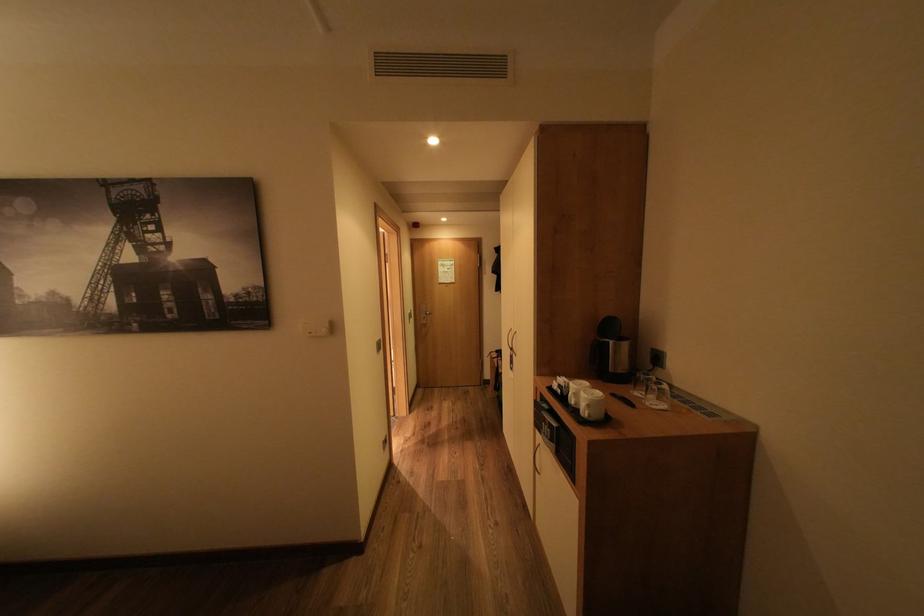
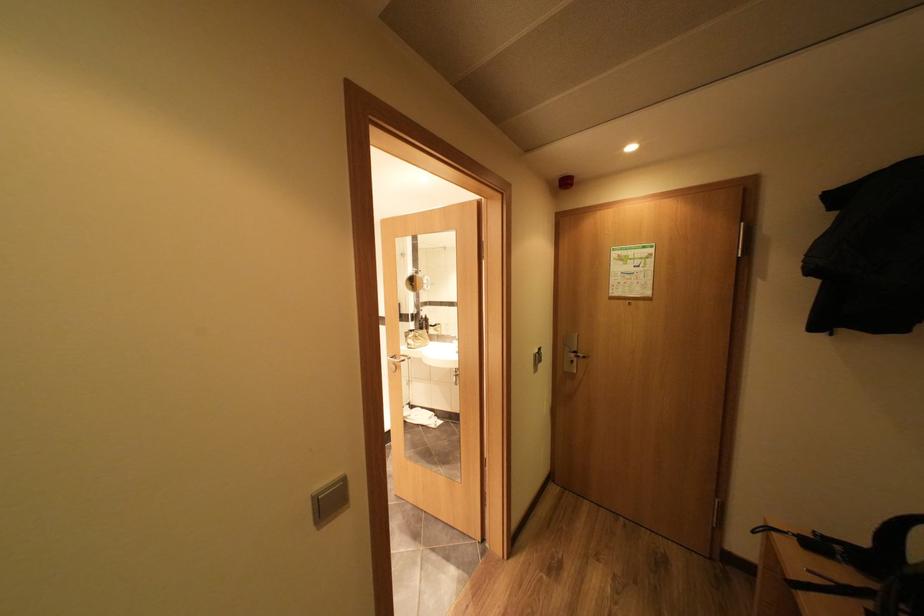
Find the pixel in the second image that matches point (501, 354) in the first image.

(779, 529)